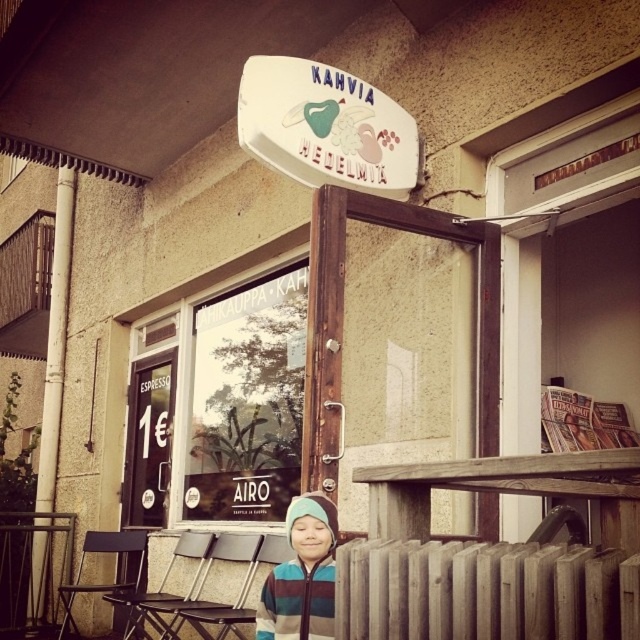
Is point (291, 600) less distant than point (58, 264)?

Yes, point (291, 600) is closer to viewer.

Does striped fleece jacket at center appear on the left side of white plastic pole at left?

In fact, striped fleece jacket at center is to the right of white plastic pole at left.

Where is `striped fleece jacket at center`? striped fleece jacket at center is located at coordinates (301, 576).

Is metallic silver chair at center bigger than metallic folding chair at lower left?

Correct, metallic silver chair at center is larger in size than metallic folding chair at lower left.

Does metallic silver chair at center appear on the left side of metallic folding chair at lower left?

No, metallic silver chair at center is not to the left of metallic folding chair at lower left.

Find the location of `metallic silver chair at center`. metallic silver chair at center is located at coordinates (204, 586).

Between point (602, 611) and point (275, 580), which one is positioned in front?

Point (602, 611) is more forward.

Between wooden radiator at lower center and striped fleece jacket at center, which one is positioned higher?

Positioned higher is wooden radiator at lower center.

Where is `wooden radiator at lower center`? The image size is (640, 640). wooden radiator at lower center is located at coordinates (476, 592).